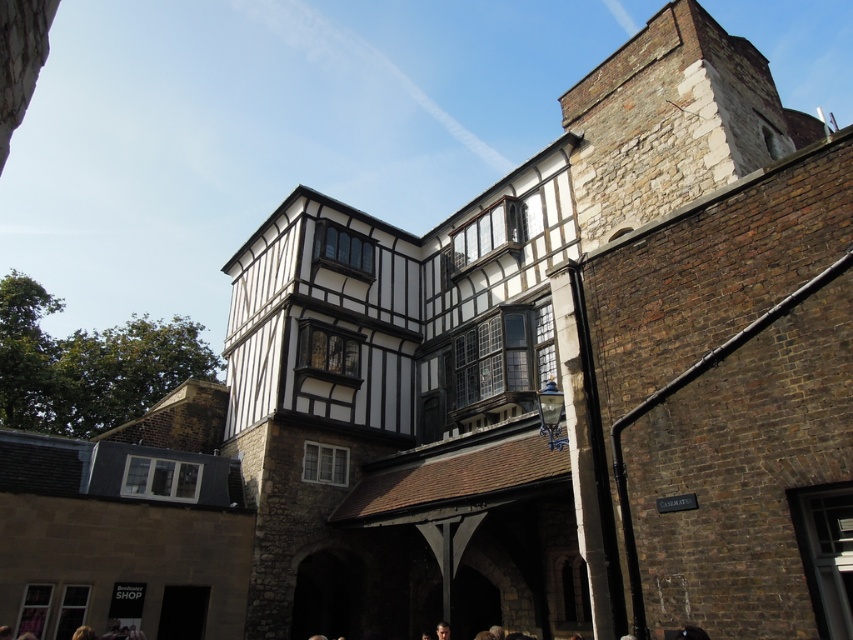
Is point (318, 403) closer to viewer compared to point (448, 627)?

No, (318, 403) is behind (448, 627).

The width and height of the screenshot is (853, 640). Identify the location of white timber-framed building at center. (566, 372).

Between white timber-framed building at center and blonde hair at lower left, which one appears on the right side from the viewer's perspective?

white timber-framed building at center

Is white timber-framed building at center positioned behind blonde hair at lower left?

No, white timber-framed building at center is closer to the viewer.

Between point (646, 278) and point (74, 636), which one is positioned behind?

Point (74, 636)

This screenshot has height=640, width=853. In order to click on white timber-framed building at center in this screenshot , I will do `click(566, 372)`.

Is blonde hair at lower left below dark brown hair at lower center?

No, blonde hair at lower left is not below dark brown hair at lower center.

Who is shorter, blonde hair at lower left or dark brown hair at lower center?

Standing shorter between the two is blonde hair at lower left.

Which is behind, point (84, 630) or point (440, 632)?

Positioned behind is point (440, 632).

You are a GUI agent. You are given a task and a screenshot of the screen. Output one action in this format:
    pyautogui.click(x=<x>, y=<y>)
    Task: Click on the blonde hair at lower left
    Image resolution: width=853 pixels, height=640 pixels.
    Given the screenshot: What is the action you would take?
    pyautogui.click(x=83, y=632)